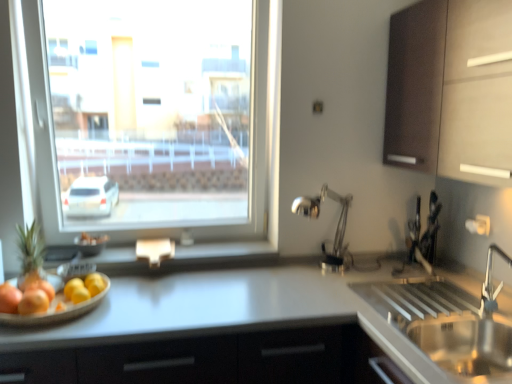
Question: Considering the relative positions of yellow matte lemon at lower left, the 1th fruit positioned from the right, and transparent glass window at upper left in the image provided, is yellow matte lemon at lower left, the 1th fruit positioned from the right, behind transparent glass window at upper left?

Choices:
 (A) yes
 (B) no

Answer: (B)

Question: Does yellow matte lemon at lower left, the 2th fruit positioned from the left, have a larger size compared to transparent glass window at upper left?

Choices:
 (A) no
 (B) yes

Answer: (A)

Question: Is yellow matte lemon at lower left, the 1th fruit positioned from the right, wider than transparent glass window at upper left?

Choices:
 (A) no
 (B) yes

Answer: (A)

Question: Is yellow matte lemon at lower left, the 2th fruit positioned from the left, outside of transparent glass window at upper left?

Choices:
 (A) yes
 (B) no

Answer: (A)

Question: Considering the relative positions of yellow matte lemon at lower left, the 1th fruit positioned from the right, and transparent glass window at upper left in the image provided, is yellow matte lemon at lower left, the 1th fruit positioned from the right, to the left of transparent glass window at upper left from the viewer's perspective?

Choices:
 (A) no
 (B) yes

Answer: (B)

Question: From the image's perspective, relative to dark wood cabinet at upper right, is silver metallic faucet at right above or below?

Choices:
 (A) above
 (B) below

Answer: (B)

Question: Do you think silver metallic faucet at right is within dark wood cabinet at upper right, or outside of it?

Choices:
 (A) outside
 (B) inside

Answer: (A)

Question: From their relative heights in the image, would you say silver metallic faucet at right is taller or shorter than dark wood cabinet at upper right?

Choices:
 (A) tall
 (B) short

Answer: (B)

Question: Based on their sizes in the image, would you say silver metallic faucet at right is bigger or smaller than dark wood cabinet at upper right?

Choices:
 (A) small
 (B) big

Answer: (A)

Question: From a real-world perspective, is white glossy countertop at center positioned above or below green matte pineapple at left?

Choices:
 (A) below
 (B) above

Answer: (A)

Question: From the image's perspective, is white glossy countertop at center positioned above or below green matte pineapple at left?

Choices:
 (A) below
 (B) above

Answer: (A)

Question: From their relative heights in the image, would you say white glossy countertop at center is taller or shorter than green matte pineapple at left?

Choices:
 (A) tall
 (B) short

Answer: (A)

Question: Does point (419, 374) appear closer or farther from the camera than point (22, 228)?

Choices:
 (A) farther
 (B) closer

Answer: (B)

Question: From a real-world perspective, is green matte pineapple at left above or below smooth wooden tray at lower left, which is the 1th fruit from left to right?

Choices:
 (A) above
 (B) below

Answer: (A)

Question: Looking at the image, does green matte pineapple at left seem bigger or smaller compared to smooth wooden tray at lower left, which is the 2th fruit in right-to-left order?

Choices:
 (A) big
 (B) small

Answer: (B)